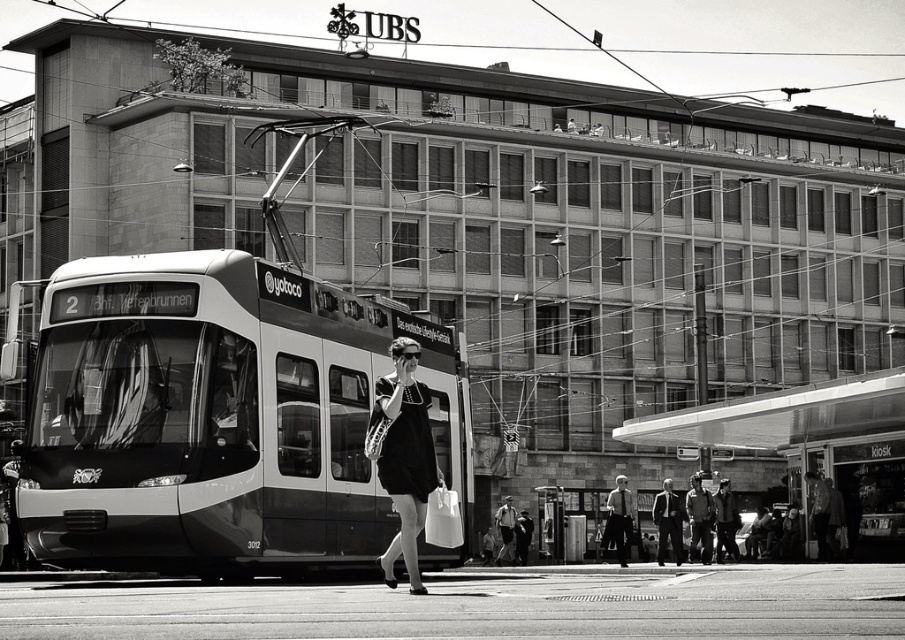
Question: Can you confirm if dark suit at center is positioned to the right of dark fabric jacket at center?

Choices:
 (A) no
 (B) yes

Answer: (B)

Question: Does dark gray uniform at center have a greater width compared to dark gray jacket at center?

Choices:
 (A) no
 (B) yes

Answer: (B)

Question: Which point is closer to the camera taking this photo?

Choices:
 (A) (670, 513)
 (B) (527, 524)
 (C) (727, 496)

Answer: (A)

Question: Estimate the real-world distances between objects in this image. Which object is farther from the dark gray uniform at center?

Choices:
 (A) dark gray jacket at center
 (B) black matte dress at center

Answer: (B)

Question: Is dark gray jacket at center to the right of leather jacket at center from the viewer's perspective?

Choices:
 (A) yes
 (B) no

Answer: (B)

Question: Estimate the real-world distances between objects in this image. Which object is closer to the leather jacket at center?

Choices:
 (A) black silk tie at center
 (B) dark gray uniform at center
 (C) black matte dress at center
 (D) dark gray jacket at center

Answer: (D)